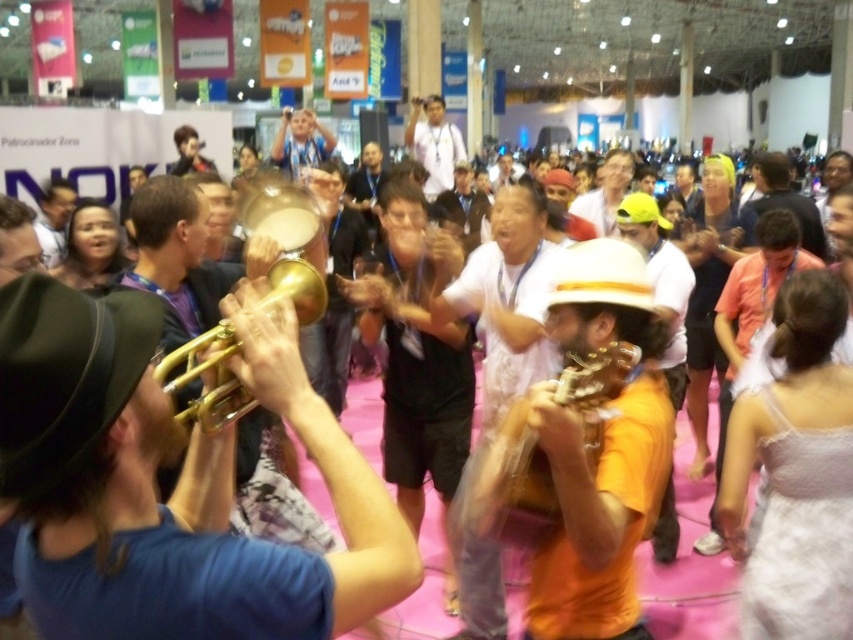
Question: Which object is positioned closest to the matte black hat at upper left?

Choices:
 (A) orange matte guitar at center
 (B) shiny gold trumpet at center
 (C) light blue shirt at center
 (D) white cotton shirt at center

Answer: (C)

Question: Is shiny gold trumpet at center below white cotton shirt at center?

Choices:
 (A) no
 (B) yes

Answer: (B)

Question: Estimate the real-world distances between objects in this image. Which object is closer to the wooden acoustic guitar at center?

Choices:
 (A) light blue shirt at center
 (B) orange matte guitar at center
 (C) gold brass trumpet at center
 (D) matte black hat at upper left

Answer: (B)

Question: From the image, what is the correct spatial relationship of gold brass trumpet at center in relation to light brown leather jacket at upper center?

Choices:
 (A) below
 (B) above

Answer: (A)

Question: Which of the following is the farthest from the observer?

Choices:
 (A) light blue shirt at center
 (B) wooden acoustic guitar at center

Answer: (A)

Question: Does wooden acoustic guitar at center have a lesser width compared to light brown leather jacket at upper center?

Choices:
 (A) yes
 (B) no

Answer: (A)